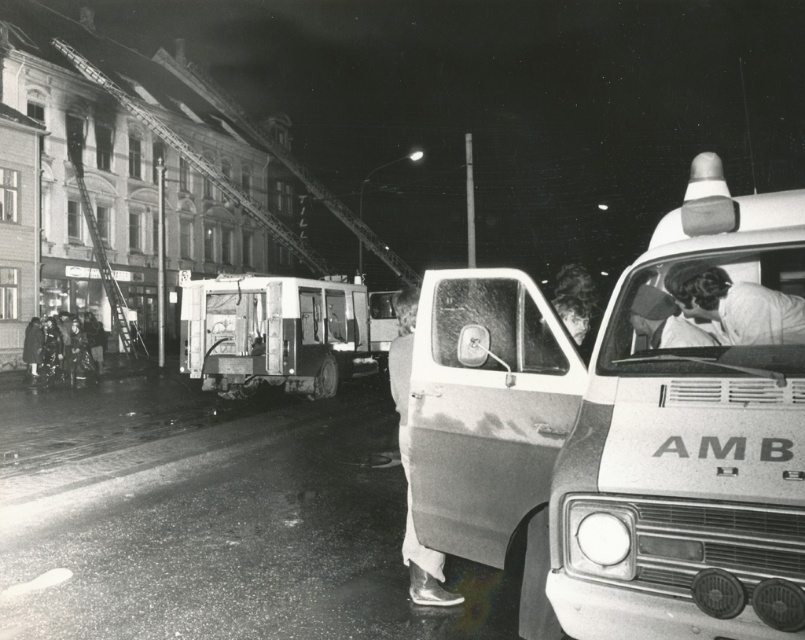
Between point (380, 308) and point (407, 545), which one is positioned behind?

The point (380, 308) is behind.

Is metallic silver ambulance at center in front of metallic silver shoe at lower center?

No, metallic silver ambulance at center is further to the viewer.

Locate an element on the screen. Image resolution: width=805 pixels, height=640 pixels. metallic silver ambulance at center is located at coordinates (281, 332).

Looking at this image, can you confirm if white plastic ambulance at center is positioned to the right of metallic silver shoe at lower center?

Correct, you'll find white plastic ambulance at center to the right of metallic silver shoe at lower center.

This screenshot has height=640, width=805. In order to click on white plastic ambulance at center in this screenshot , I will do `click(630, 429)`.

Does point (687, 397) lie in front of point (399, 371)?

Yes, point (687, 397) is in front of point (399, 371).

Identify the location of white plastic ambulance at center. The height and width of the screenshot is (640, 805). (630, 429).

Can you confirm if white plastic ambulance at center is positioned below metallic silver ambulance at center?

Correct, white plastic ambulance at center is located below metallic silver ambulance at center.

Between white plastic ambulance at center and metallic silver ambulance at center, which one is positioned higher?

metallic silver ambulance at center

The height and width of the screenshot is (640, 805). Describe the element at coordinates (630, 429) in the screenshot. I see `white plastic ambulance at center` at that location.

Where is `white plastic ambulance at center`? This screenshot has height=640, width=805. white plastic ambulance at center is located at coordinates (630, 429).